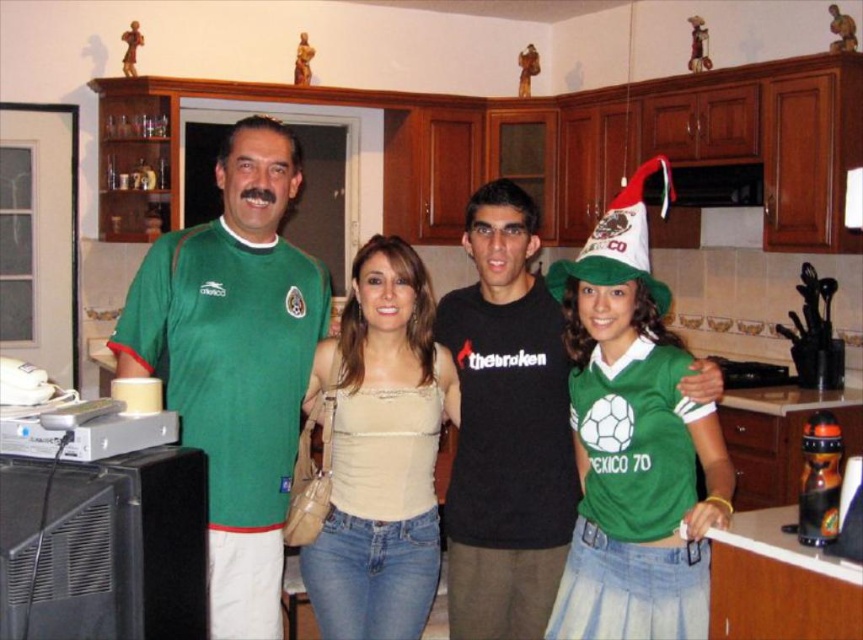
Question: Is matte green jersey at center further to the viewer compared to green jersey at center?

Choices:
 (A) no
 (B) yes

Answer: (B)

Question: Which point is farther from the camera taking this photo?

Choices:
 (A) (499, 358)
 (B) (621, 237)
 (C) (263, 508)
 (D) (184, 404)

Answer: (A)

Question: Is green jersey at center thinner than green felt christmas hat at center right?

Choices:
 (A) yes
 (B) no

Answer: (B)

Question: Is matte green jersey at center to the right of green jersey at center from the viewer's perspective?

Choices:
 (A) yes
 (B) no

Answer: (B)

Question: Which of the following is the farthest from the observer?

Choices:
 (A) (660, 284)
 (B) (215, 428)
 (C) (225, 541)
 (D) (446, 570)

Answer: (D)

Question: Which object appears closest to the camera in this image?

Choices:
 (A) black matte t-shirt at center
 (B) green jersey at center

Answer: (B)